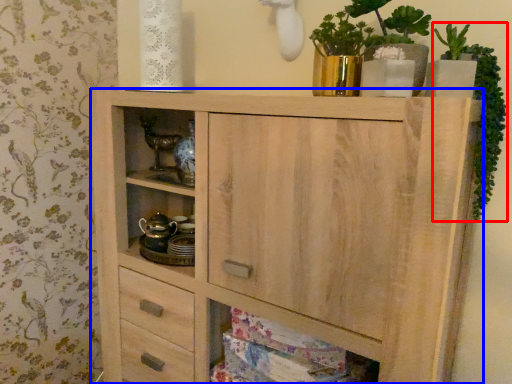
Question: Which point is closer to the camera, plant (highlighted by a red box) or chest of drawers (highlighted by a blue box)?

Choices:
 (A) plant
 (B) chest of drawers

Answer: (B)